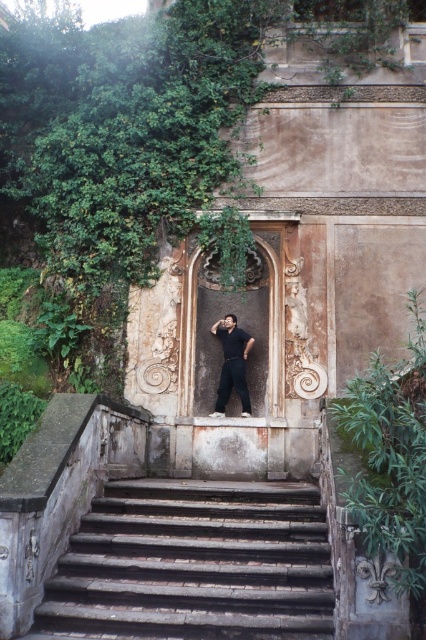
You are a photographer setting up for a shoot. The man in the image is standing on the dark gray stone stairs at center wearing dark gray cotton pants at center. To ensure he doesn not slip, you need to know if his pants are touching the stairs. Are they?

The dark gray stone stairs at center is positioned under dark gray cotton pants at center, meaning the pants are in direct contact with the stairs. Therefore, the man is wearing pants that are touching the stairs.

You are an architect designing a new building and want to ensure the entrance door is wider than the visitor standing in front of it. Given the scene described, would the rustic stone door at center be wider than the dark gray cotton pants at center?

The rustic stone door at center is narrower than the dark gray cotton pants at center, so it would not be wider than the visitor wearing the dark gray cotton pants at center.

You are standing at the base of the stone stairs leading up to the ornate doorway. You notice two points marked on the scene. Which point, point (307, 529) or point (388, 499), is closer to you?

Point (307, 529) is closer to you because it is further to the viewer than point (388, 499).